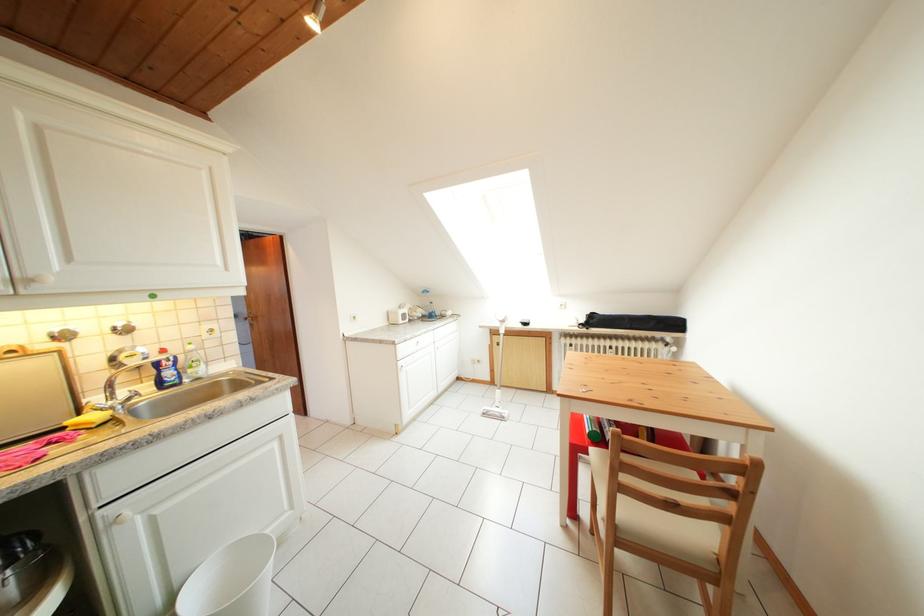
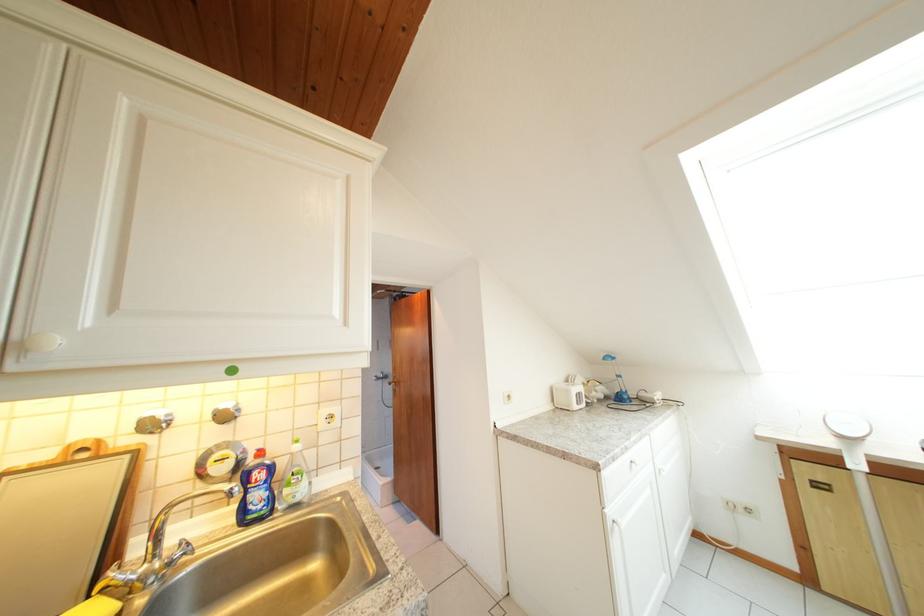
In the second image, find the point that corresponds to point 432,318 in the first image.

(614, 397)